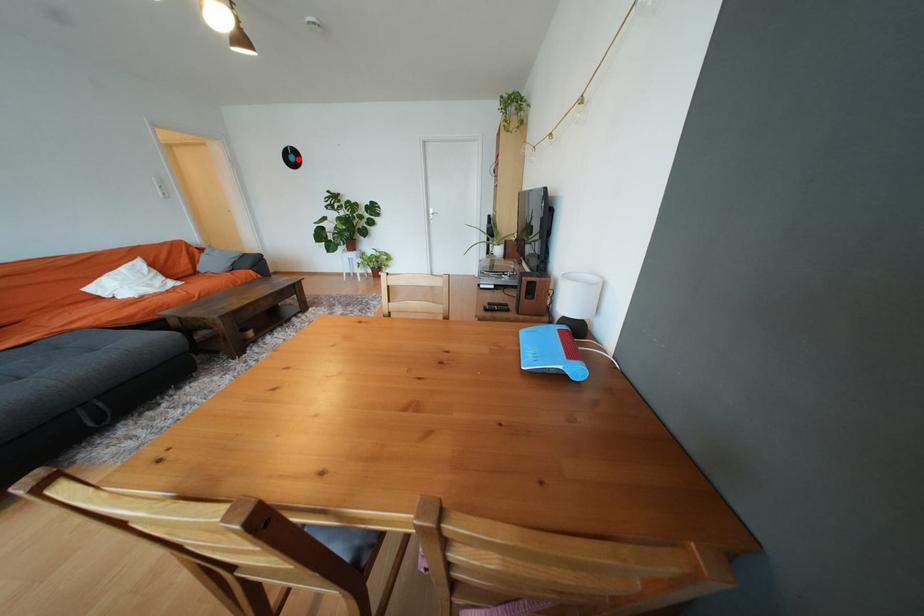
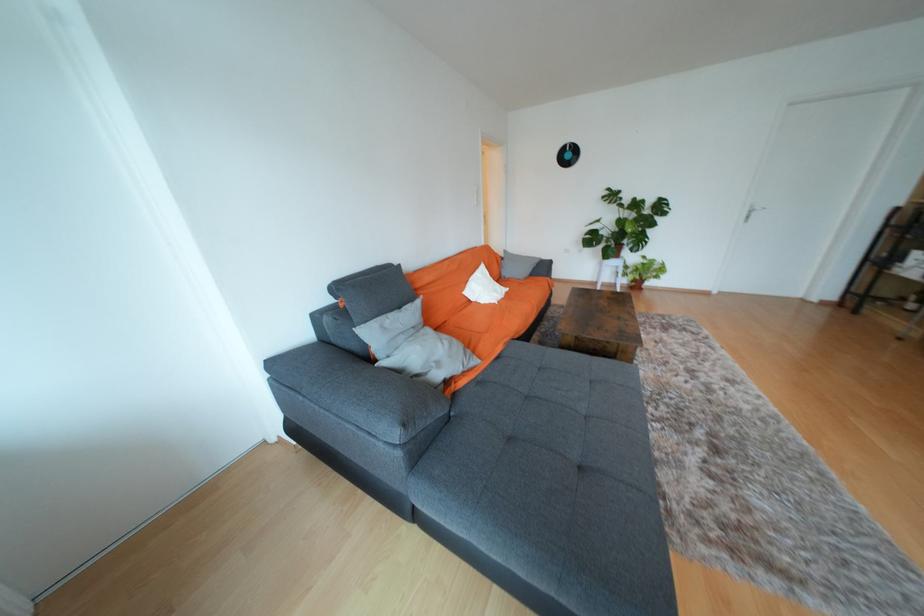
Question: I am providing you with two images of the same scene from different viewpoints. In image1, a red point is highlighted. Considering the same 3D point in image2, which of the following is correct?

Choices:
 (A) It is closer
 (B) It is farther

Answer: (B)